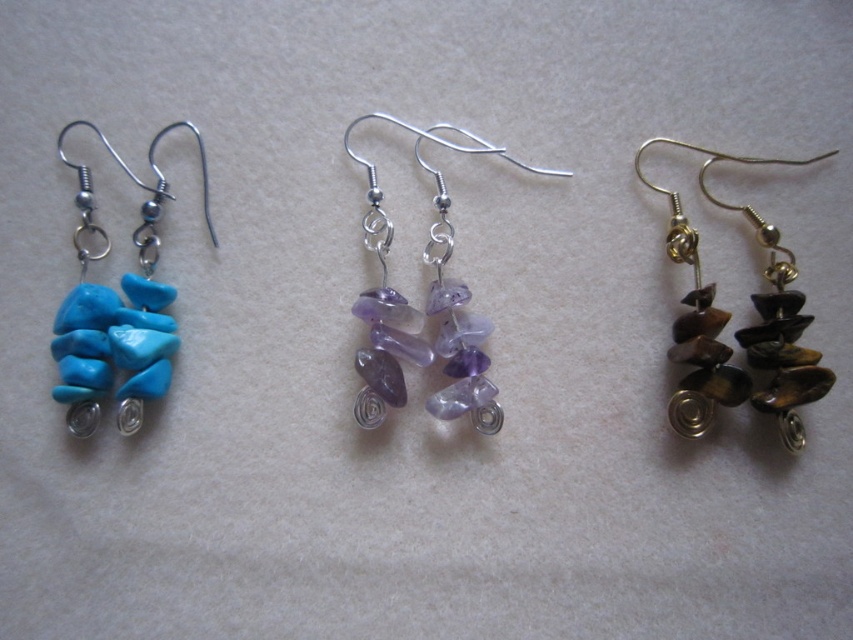
You are a jeweler examining the layout of the earrings. Which pair is closer to the viewer between the brown polished stone earrings at right and the purple translucent stones at center?

The brown polished stone earrings at right are closer to the viewer because they are positioned in front of the purple translucent stones at center.

You are a customer at a jewelry store looking to buy earrings that are shorter in length. You see the brown polished stone earrings at right and the purple translucent stones at center. Which pair should you choose?

The brown polished stone earrings at right is shorter than the purple translucent stones at center, so you should choose the brown polished stone earrings at right.